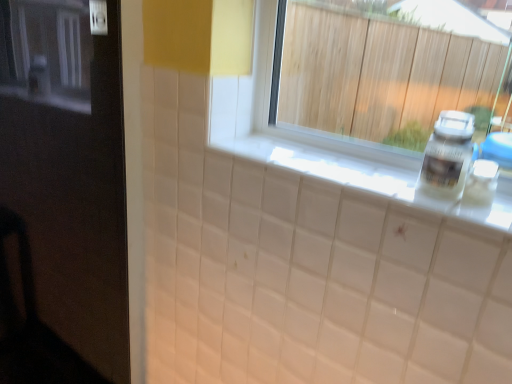
Find the location of a particular element. The image size is (512, 384). white plastic bottle at right is located at coordinates (447, 155).

What do you see at coordinates (447, 155) in the screenshot? The width and height of the screenshot is (512, 384). I see `white plastic bottle at right` at bounding box center [447, 155].

The width and height of the screenshot is (512, 384). What do you see at coordinates (362, 176) in the screenshot?
I see `white glossy counter top at center` at bounding box center [362, 176].

What is the approximate width of black glossy door at left?

It is 22.58 inches.

What do you see at coordinates (62, 196) in the screenshot? I see `black glossy door at left` at bounding box center [62, 196].

You are a GUI agent. You are given a task and a screenshot of the screen. Output one action in this format:
    pyautogui.click(x=<x>, y=<y>)
    Task: Click on the white plastic bottle at right
    
    Given the screenshot: What is the action you would take?
    pyautogui.click(x=447, y=155)

Identify the location of bottle on the right of black glossy door at left. (447, 155).

Considering the relative positions of black glossy door at left and white plastic bottle at right in the image provided, is black glossy door at left to the right of white plastic bottle at right from the viewer's perspective?

Incorrect, black glossy door at left is not on the right side of white plastic bottle at right.

Is black glossy door at left inside or outside of white plastic bottle at right?

black glossy door at left cannot be found inside white plastic bottle at right.

Between black glossy door at left and white plastic bottle at right, which one has smaller width?

With smaller width is white plastic bottle at right.

Considering the points (449, 171) and (255, 140), which point is in front, point (449, 171) or point (255, 140)?

The point (449, 171) is closer to the camera.

From the picture: Is white plastic bottle at right at the right side of white glossy counter top at center?

Correct, you'll find white plastic bottle at right to the right of white glossy counter top at center.

Is white plastic bottle at right turned away from white glossy counter top at center?

No, white plastic bottle at right's orientation is not away from white glossy counter top at center.

Considering the sizes of objects white plastic bottle at right and white glossy counter top at center in the image provided, who is wider, white plastic bottle at right or white glossy counter top at center?

Wider between the two is white glossy counter top at center.

From a real-world perspective, is white glossy counter top at center physically below white plastic bottle at right?

Yes.

Is white glossy counter top at center to the right of white plastic bottle at right from the viewer's perspective?

Incorrect, white glossy counter top at center is not on the right side of white plastic bottle at right.

Is white glossy counter top at center completely or partially outside of white plastic bottle at right?

That's correct, white glossy counter top at center is outside of white plastic bottle at right.

Is white glossy counter top at center positioned with its back to white plastic bottle at right?

No, white glossy counter top at center is not facing away from white plastic bottle at right.

Is white glossy counter top at center facing away from black glossy door at left?

white glossy counter top at center does not have its back to black glossy door at left.

Considering the sizes of white glossy counter top at center and black glossy door at left in the image, is white glossy counter top at center taller or shorter than black glossy door at left?

Clearly, white glossy counter top at center is shorter compared to black glossy door at left.

From a real-world perspective, is white glossy counter top at center above or below black glossy door at left?

Clearly, from a real-world perspective, white glossy counter top at center is above black glossy door at left.

Consider the image. Does white glossy counter top at center touch black glossy door at left?

No, white glossy counter top at center is not beside black glossy door at left.

Between black glossy door at left and white glossy counter top at center, which one appears on the right side from the viewer's perspective?

white glossy counter top at center.

From the image's perspective, between black glossy door at left and white glossy counter top at center, who is located below?

black glossy door at left is shown below in the image.

From the picture: Is black glossy door at left taller than white glossy counter top at center?

Indeed, black glossy door at left has a greater height compared to white glossy counter top at center.

Is black glossy door at left in front of or behind white glossy counter top at center in the image?

Clearly, black glossy door at left is in front of white glossy counter top at center.

From a real-world perspective, is white plastic bottle at right physically below black glossy door at left?

No, from a real-world perspective, white plastic bottle at right is not beneath black glossy door at left.

How many degrees apart are the facing directions of white plastic bottle at right and black glossy door at left?

white plastic bottle at right and black glossy door at left are facing 89.3 degrees away from each other.

Consider the image. Is black glossy door at left completely or partially inside white plastic bottle at right?

That's incorrect, black glossy door at left is not inside white plastic bottle at right.

Image resolution: width=512 pixels, height=384 pixels. In order to click on bottle above the black glossy door at left (from a real-world perspective) in this screenshot , I will do `click(447, 155)`.

Where is `bottle above the black glossy door at left (from a real-world perspective)`? This screenshot has height=384, width=512. bottle above the black glossy door at left (from a real-world perspective) is located at coordinates click(x=447, y=155).

At what (x,y) coordinates should I click in order to perform the action: click on counter top below the white plastic bottle at right (from the image's perspective). Please return your answer as a coordinate pair (x, y). This screenshot has width=512, height=384. Looking at the image, I should click on (362, 176).

From the picture: Based on their spatial positions, is white plastic bottle at right or black glossy door at left further from white glossy counter top at center?

white plastic bottle at right is further to white glossy counter top at center.

Looking at the image, which one is located further to black glossy door at left, white glossy counter top at center or white plastic bottle at right?

The object further to black glossy door at left is white plastic bottle at right.

Estimate the real-world distances between objects in this image. Which object is further from black glossy door at left, white plastic bottle at right or white glossy counter top at center?

Based on the image, white plastic bottle at right appears to be further to black glossy door at left.

When comparing their distances from white glossy counter top at center, does black glossy door at left or white plastic bottle at right seem further?

Based on the image, white plastic bottle at right appears to be further to white glossy counter top at center.

When comparing their distances from white plastic bottle at right, does white glossy counter top at center or black glossy door at left seem closer?

white glossy counter top at center.

Looking at the image, which one is located further to white plastic bottle at right, black glossy door at left or white glossy counter top at center?

The object further to white plastic bottle at right is black glossy door at left.

Locate an element on the screen. counter top between black glossy door at left and white plastic bottle at right in the horizontal direction is located at coordinates (362, 176).